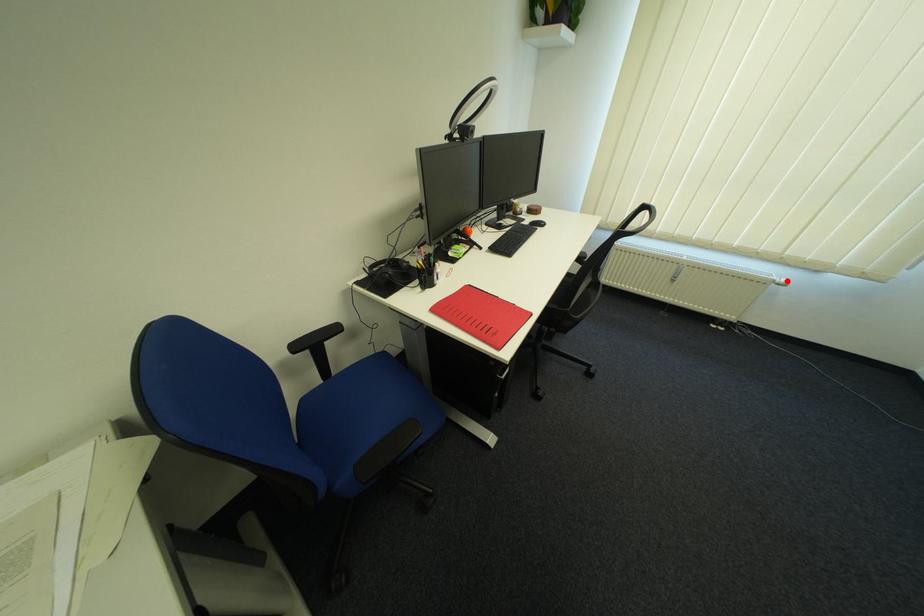
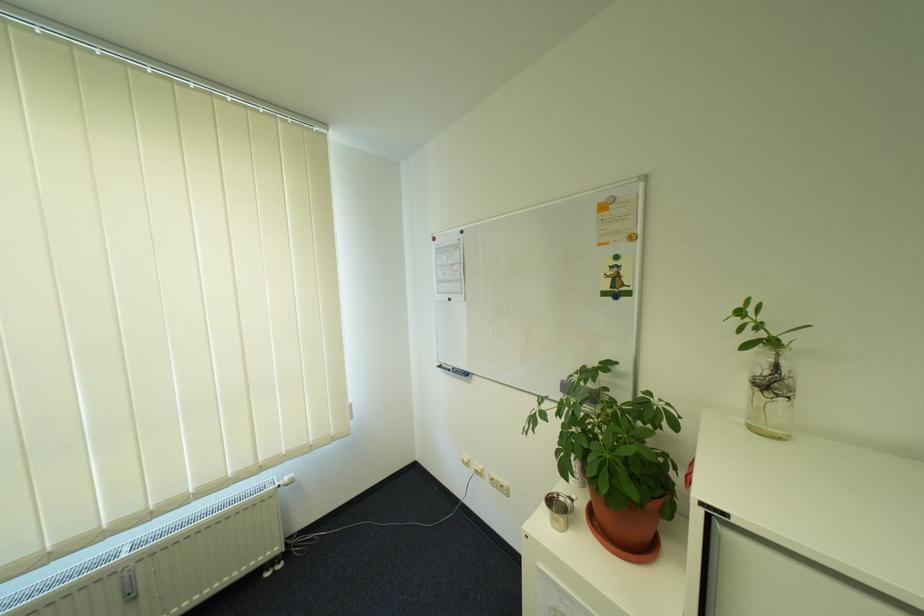
Question: A red point is marked in image1. In image2, is the corresponding 3D point closer to the camera or farther? Reply with the corresponding letter.

Choices:
 (A) The corresponding 3D point is closer.
 (B) The corresponding 3D point is farther.

Answer: (B)